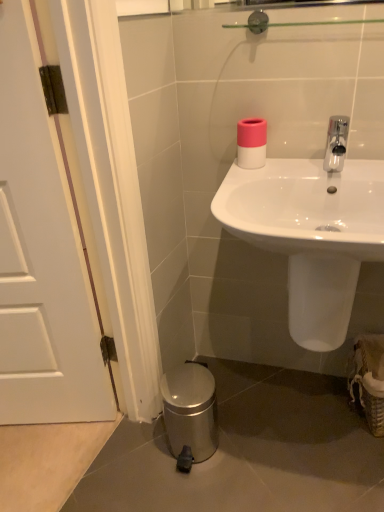
Where is `vacant point to the left of woven straw basket at lower right`? Image resolution: width=384 pixels, height=512 pixels. vacant point to the left of woven straw basket at lower right is located at coordinates (324, 417).